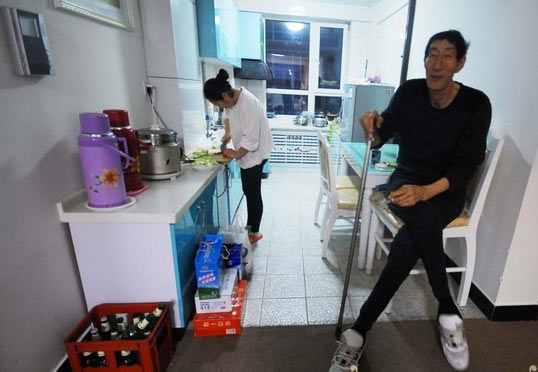
Find the location of `table`. table is located at coordinates (353, 155).